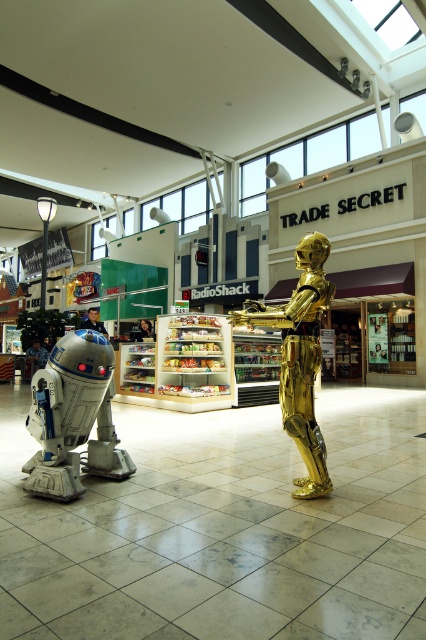
Between silver metallic robot at left and gold metallic statue at center, which one is positioned lower?

silver metallic robot at left

Is silver metallic robot at left taller than gold metallic statue at center?

No.

Which is in front, point (98, 362) or point (275, 316)?

Point (275, 316)

What are the coordinates of `silver metallic robot at left` in the screenshot? It's located at (74, 417).